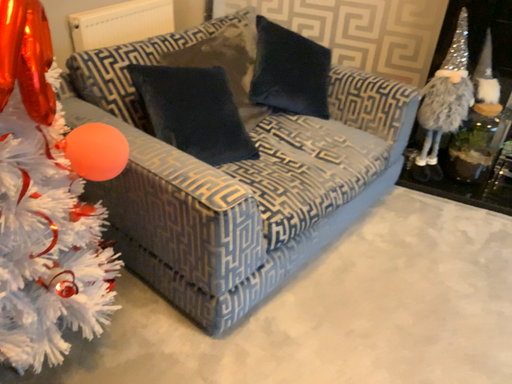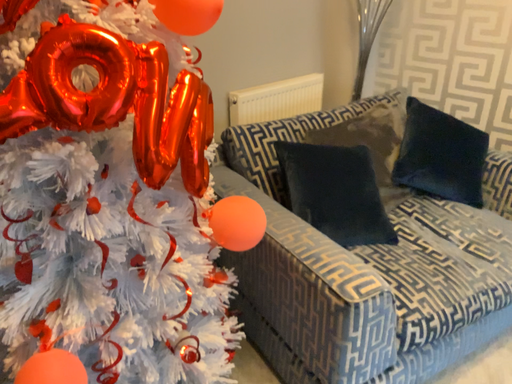
Question: Which way did the camera rotate in the video?

Choices:
 (A) rotated right
 (B) rotated left

Answer: (B)